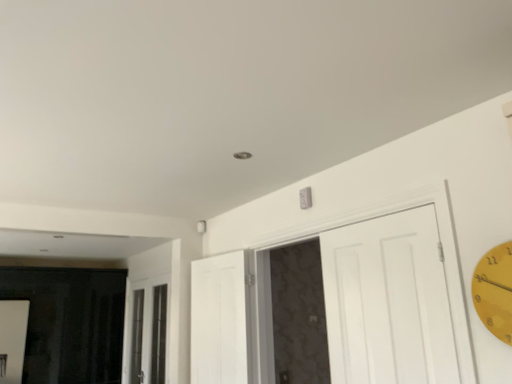
Question: Which direction should I rotate to look at white wood door at center, the 2th door positioned from the right, — up or down?

Choices:
 (A) up
 (B) down

Answer: (B)

Question: Can you confirm if yellow matte clock at right is thinner than white wood door at center, which ranks as the 1th door in left-to-right order?

Choices:
 (A) yes
 (B) no

Answer: (A)

Question: From the image's perspective, does yellow matte clock at right appear lower than white wood door at center, which ranks as the 1th door in left-to-right order?

Choices:
 (A) yes
 (B) no

Answer: (B)

Question: Can you confirm if yellow matte clock at right is smaller than white wood door at center, the 2th door positioned from the right?

Choices:
 (A) yes
 (B) no

Answer: (A)

Question: From the image's perspective, does yellow matte clock at right appear higher than white wood door at center, the 2th door positioned from the right?

Choices:
 (A) yes
 (B) no

Answer: (A)

Question: Is yellow matte clock at right placed right next to white wood door at center, which ranks as the 1th door in left-to-right order?

Choices:
 (A) no
 (B) yes

Answer: (A)

Question: Is yellow matte clock at right wider than white wood door at center, which ranks as the 1th door in left-to-right order?

Choices:
 (A) no
 (B) yes

Answer: (A)

Question: Would you say clear glass window at center is outside white matte door at upper center, the 1th door viewed from the right?

Choices:
 (A) no
 (B) yes

Answer: (B)

Question: From the image's perspective, is clear glass window at center located above white matte door at upper center, the 1th door viewed from the right?

Choices:
 (A) yes
 (B) no

Answer: (B)

Question: Is clear glass window at center closer to the viewer compared to white matte door at upper center, the 1th door viewed from the right?

Choices:
 (A) yes
 (B) no

Answer: (B)

Question: Is clear glass window at center placed right next to white matte door at upper center, the 1th door viewed from the right?

Choices:
 (A) no
 (B) yes

Answer: (A)

Question: Is clear glass window at center looking in the opposite direction of white matte door at upper center, the 1th door viewed from the right?

Choices:
 (A) no
 (B) yes

Answer: (A)

Question: Does clear glass window at center turn towards white matte door at upper center, the 2th door from the left?

Choices:
 (A) no
 (B) yes

Answer: (A)

Question: Does white wood door at center, which ranks as the 1th door in left-to-right order, appear on the left side of white matte door at upper center, the 2th door from the left?

Choices:
 (A) yes
 (B) no

Answer: (A)